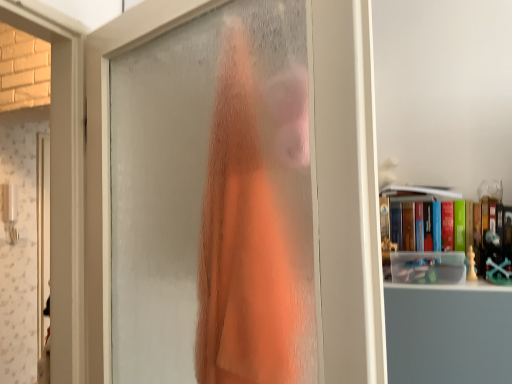
Question: Is hardcover book at upper right bigger than frosted glass door at center?

Choices:
 (A) yes
 (B) no

Answer: (B)

Question: Considering the relative sizes of hardcover book at upper right and frosted glass door at center in the image provided, is hardcover book at upper right smaller than frosted glass door at center?

Choices:
 (A) no
 (B) yes

Answer: (B)

Question: From a real-world perspective, is hardcover book at upper right beneath frosted glass door at center?

Choices:
 (A) no
 (B) yes

Answer: (B)

Question: Does hardcover book at upper right appear on the left side of frosted glass door at center?

Choices:
 (A) no
 (B) yes

Answer: (A)

Question: Is hardcover book at upper right oriented away from frosted glass door at center?

Choices:
 (A) no
 (B) yes

Answer: (A)

Question: Considering the positions of hardcover book at upper right and frosted glass door at center in the image, is hardcover book at upper right taller or shorter than frosted glass door at center?

Choices:
 (A) tall
 (B) short

Answer: (B)

Question: Based on their sizes in the image, would you say hardcover book at upper right is bigger or smaller than frosted glass door at center?

Choices:
 (A) small
 (B) big

Answer: (A)

Question: From the image's perspective, relative to frosted glass door at center, is hardcover book at upper right above or below?

Choices:
 (A) above
 (B) below

Answer: (B)

Question: Is hardcover book at upper right to the left or to the right of frosted glass door at center in the image?

Choices:
 (A) right
 (B) left

Answer: (A)

Question: From the image's perspective, is frosted glass door at center positioned above or below orange fabric at center?

Choices:
 (A) below
 (B) above

Answer: (A)

Question: Do you think frosted glass door at center is within orange fabric at center, or outside of it?

Choices:
 (A) outside
 (B) inside

Answer: (A)

Question: Considering their positions, is frosted glass door at center located in front of or behind orange fabric at center?

Choices:
 (A) front
 (B) behind

Answer: (A)

Question: From a real-world perspective, is frosted glass door at center physically located above or below orange fabric at center?

Choices:
 (A) below
 (B) above

Answer: (A)

Question: In terms of width, does orange fabric at center look wider or thinner when compared to frosted glass door at center?

Choices:
 (A) thin
 (B) wide

Answer: (A)

Question: Visually, is orange fabric at center positioned to the left or to the right of frosted glass door at center?

Choices:
 (A) left
 (B) right

Answer: (B)